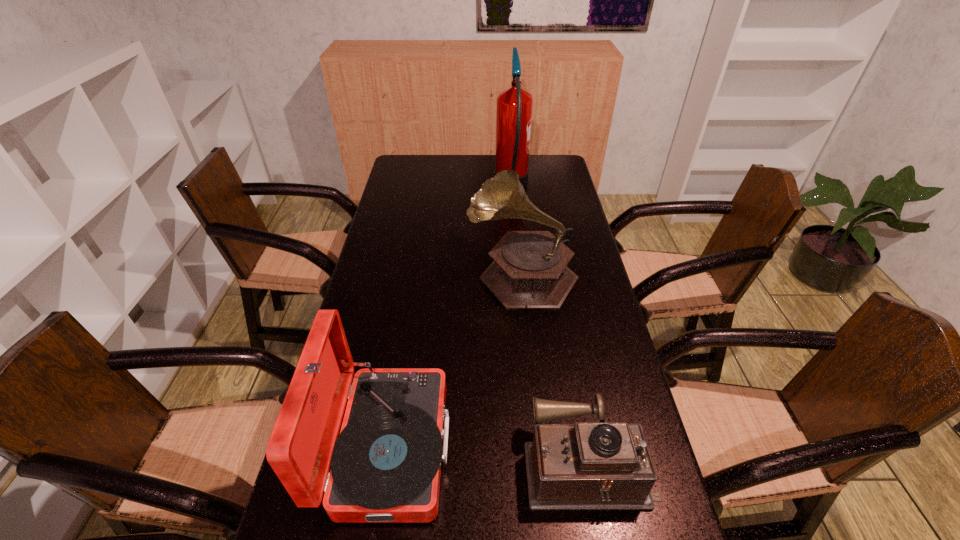
You are a GUI agent. You are given a task and a screenshot of the screen. Output one action in this format:
    pyautogui.click(x=<x>, y=<y>)
    Task: Click on the fire extinguisher
    This screenshot has height=540, width=960.
    Given the screenshot: What is the action you would take?
    pyautogui.click(x=514, y=109)

You are a GUI agent. You are given a task and a screenshot of the screen. Output one action in this format:
    pyautogui.click(x=<x>, y=<y>)
    Task: Click on the tallest object
    Image resolution: width=960 pixels, height=540 pixels.
    Given the screenshot: What is the action you would take?
    pyautogui.click(x=514, y=109)

Image resolution: width=960 pixels, height=540 pixels. I want to click on the second farthest object, so click(x=529, y=271).

Image resolution: width=960 pixels, height=540 pixels. In order to click on the leftmost phonograph_record in this screenshot , I will do click(385, 464).

Identify the location of the shortest phonograph_record. (600, 465).

The height and width of the screenshot is (540, 960). In order to click on vacant area situated on the left of the farthest object in this screenshot , I will do `click(453, 185)`.

I want to click on vacant region located on the horn direction of the farthest phonograph_record, so click(x=398, y=274).

The image size is (960, 540). Find the location of `vacant space situated on the horn direction of the farthest phonograph_record`. vacant space situated on the horn direction of the farthest phonograph_record is located at coordinates (423, 274).

Image resolution: width=960 pixels, height=540 pixels. Find the location of `free space located on the horn direction of the farthest phonograph_record`. free space located on the horn direction of the farthest phonograph_record is located at coordinates (430, 274).

Identify the location of vacant region located 0.380m on the front-facing side of the leftmost phonograph_record. (619, 447).